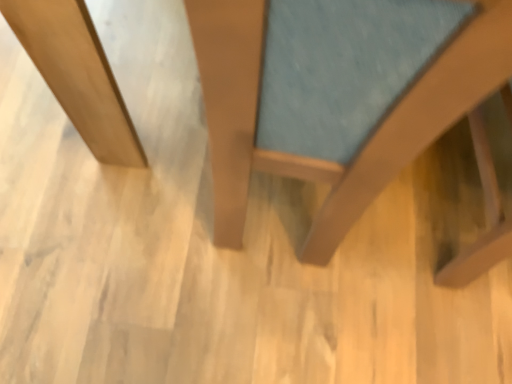
This screenshot has width=512, height=384. What do you see at coordinates (339, 95) in the screenshot?
I see `wooden chair at center` at bounding box center [339, 95].

Image resolution: width=512 pixels, height=384 pixels. I want to click on wooden chair at center, so click(x=339, y=95).

You are a GUI agent. You are given a task and a screenshot of the screen. Output one action in this format:
    pyautogui.click(x=<x>, y=<y>)
    Task: Click on the wooden chair at center
    The height and width of the screenshot is (384, 512).
    Given the screenshot: What is the action you would take?
    pyautogui.click(x=339, y=95)